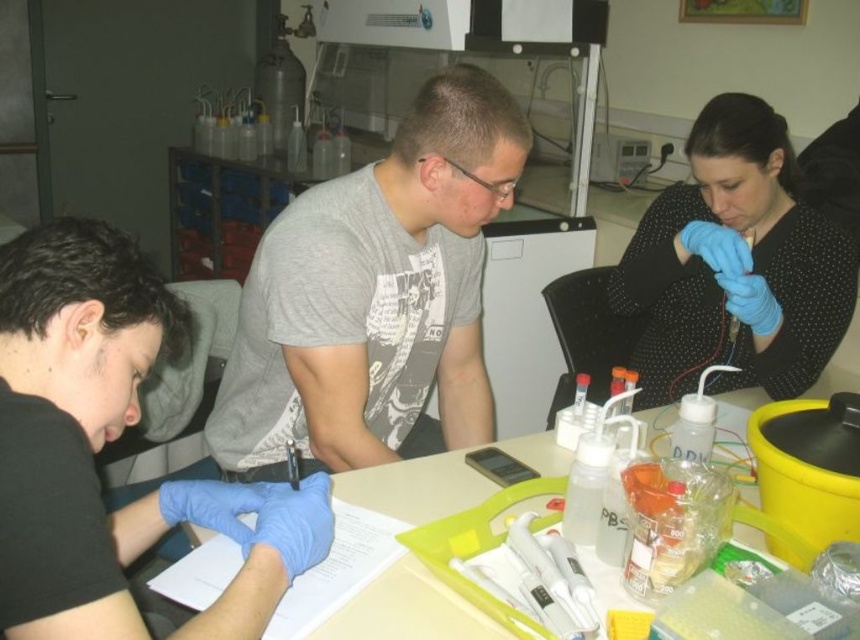
Question: In this image, where is gray printed t-shirt at center located relative to blue latex gloves at lower left?

Choices:
 (A) above
 (B) below

Answer: (A)

Question: Which of these objects is positioned farthest from the gray printed t-shirt at center?

Choices:
 (A) blue latex gloves at lower left
 (B) black dotted shirt at upper right

Answer: (B)

Question: Which of the following is the closest to the observer?

Choices:
 (A) black dotted shirt at upper right
 (B) blue latex gloves at lower left

Answer: (B)

Question: Is black dotted shirt at upper right thinner than white plastic table at center?

Choices:
 (A) yes
 (B) no

Answer: (A)

Question: Among these objects, which one is nearest to the camera?

Choices:
 (A) black dotted shirt at upper right
 (B) gray printed t-shirt at center
 (C) white plastic table at center

Answer: (C)

Question: Is gray printed t-shirt at center below blue latex gloves at lower left?

Choices:
 (A) yes
 (B) no

Answer: (B)